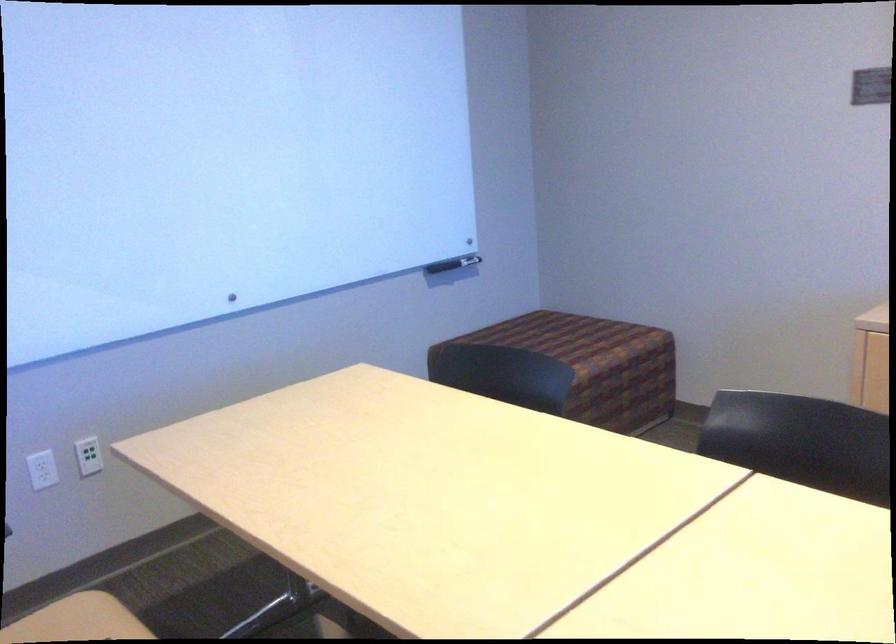
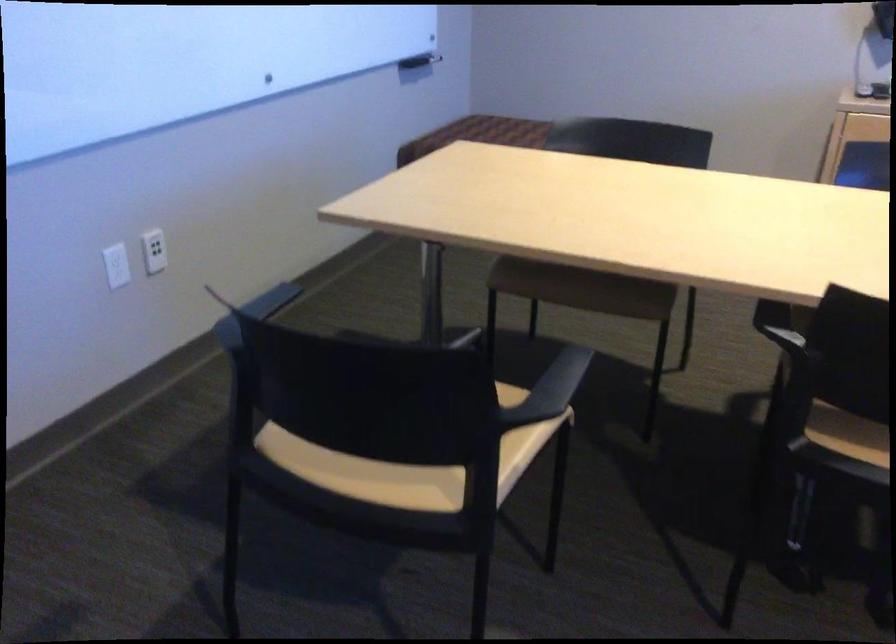
Question: What movement of the cameraman would produce the second image?

Choices:
 (A) Left
 (B) Right
 (C) Forward
 (D) Backward

Answer: (A)